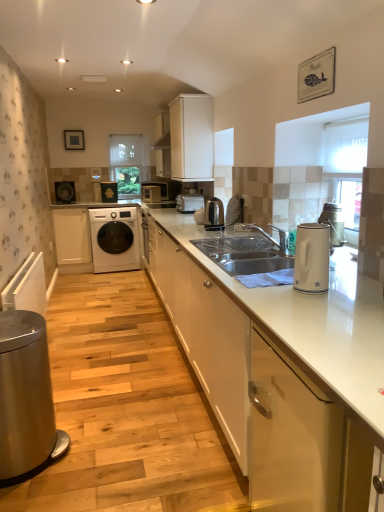
Question: Based on their positions, is matte black washing machine at left, placed as the first appliance when sorted from left to right, located to the left or right of white glossy cabinet at lower right, the first cabinetry viewed from the front?

Choices:
 (A) right
 (B) left

Answer: (B)

Question: Is matte black washing machine at left, the fourth appliance from the right, bigger or smaller than white glossy cabinet at lower right, the first cabinetry viewed from the front?

Choices:
 (A) big
 (B) small

Answer: (B)

Question: Which object is positioned closest to the metallic silver microwave at center, placed as the second appliance when sorted from right to left?

Choices:
 (A) white glossy washing machine at center
 (B) white glossy cabinet at center, acting as the 3th cabinetry starting from the back
 (C) white glossy cabinet at lower right, the first cabinetry viewed from the front
 (D) white glossy electric kettle at right, the 4th home appliance in the left-to-right sequence
 (E) matte black microwave at center, which is the 1th home appliance from top to bottom

Answer: (E)

Question: Based on their relative distances, which object is nearer to the metallic silver microwave at center, acting as the second appliance starting from the back?

Choices:
 (A) brushed metal trash can at lower left, positioned as the second home appliance in front-to-back order
 (B) matte black microwave at center, arranged as the fourth home appliance when ordered from the bottom
 (C) white textured blinds at upper right, positioned as the 2th window screen in back-to-front order
 (D) white matte cabinet at upper center, acting as the third cabinetry starting from the right
 (E) white glossy washing machine at center

Answer: (B)